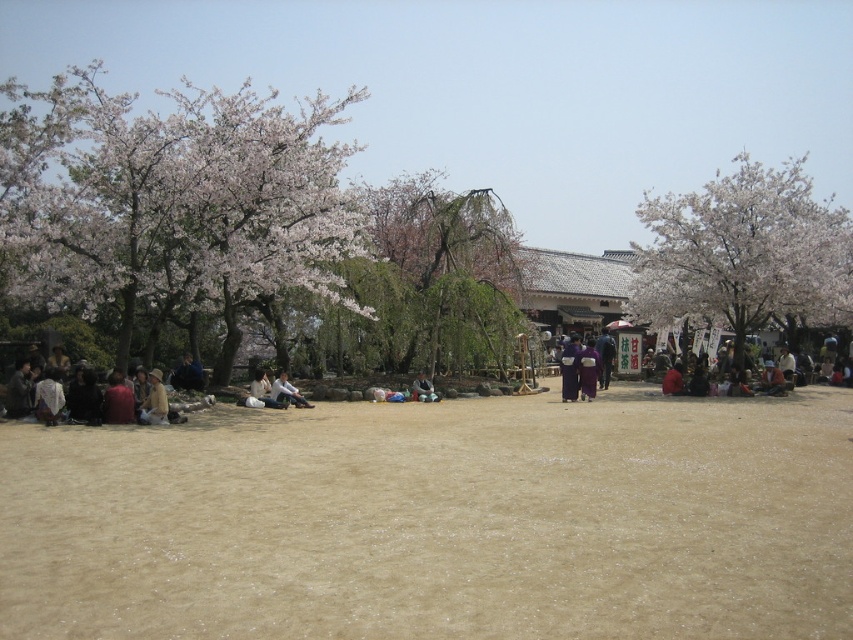
Question: Can you confirm if green leafy tree at center is positioned to the right of dark purple kimono at center?

Choices:
 (A) no
 (B) yes

Answer: (B)

Question: Which point is closer to the camera taking this photo?

Choices:
 (A) (792, 275)
 (B) (277, 403)

Answer: (B)

Question: Does light brown wooden bench at center lie in front of light brown fabric bag at center?

Choices:
 (A) no
 (B) yes

Answer: (A)

Question: Among these objects, which one is farthest from the camera?

Choices:
 (A) purple fabric at center
 (B) purple silk kimono at center
 (C) dark blue fabric at lower left

Answer: (A)

Question: Does purple silk kimono at center come behind red velvet kimono at center?

Choices:
 (A) yes
 (B) no

Answer: (B)

Question: Among these objects, which one is nearest to the camera?

Choices:
 (A) white blossoming tree at left
 (B) matte brown jacket at lower left
 (C) red velvet kimono at center
 (D) white blossoming tree at right

Answer: (B)